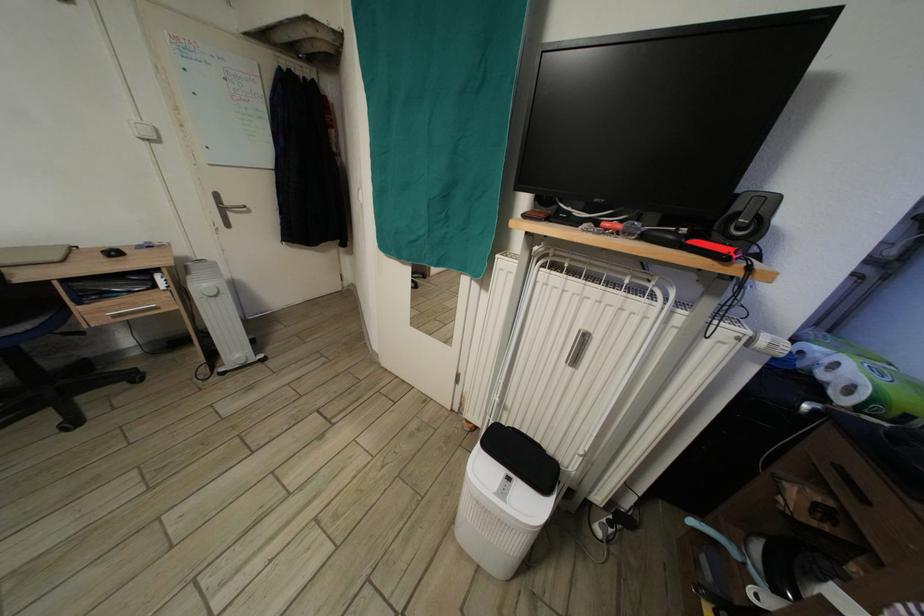
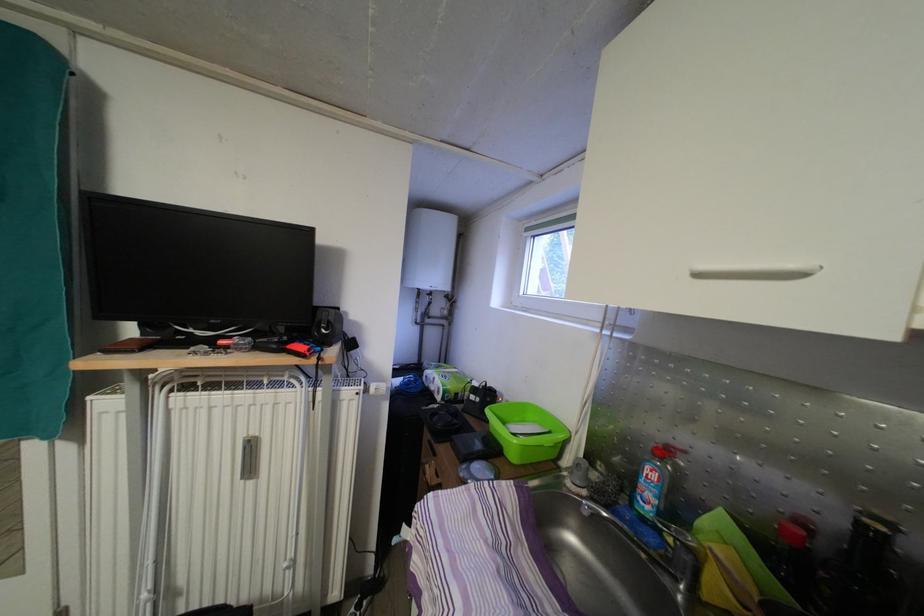
Where in the second image is the point corresponding to point (745, 222) from the first image?

(326, 329)